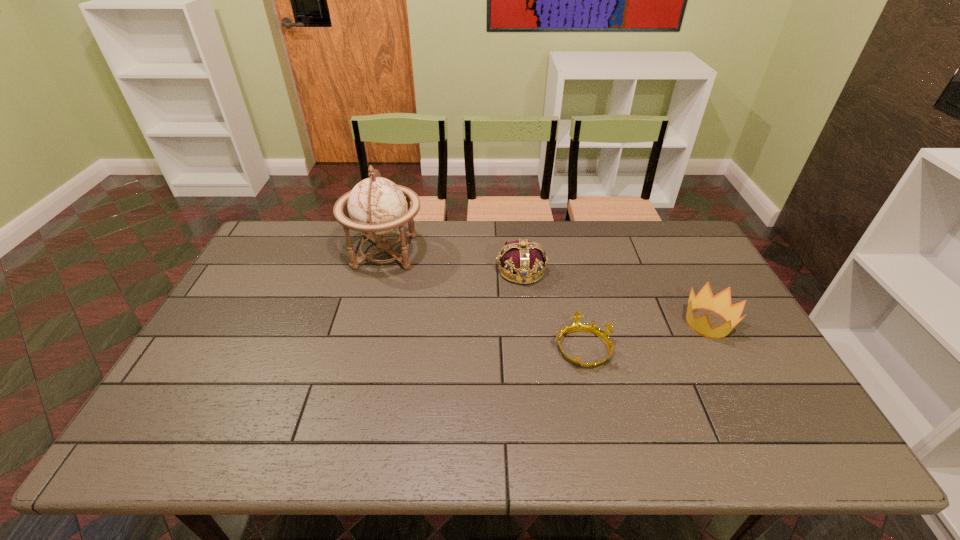
The height and width of the screenshot is (540, 960). Identify the location of vacant region between the farthest crown and the rightmost crown. click(x=614, y=297).

The width and height of the screenshot is (960, 540). In order to click on free spot between the tallest crown and the shortest object in this screenshot , I will do `click(552, 309)`.

Identify the location of free space that is in between the shortest object and the second shortest object. This screenshot has height=540, width=960. (645, 335).

This screenshot has width=960, height=540. I want to click on free point between the leftmost object and the rightmost object, so click(x=546, y=288).

Locate an element on the screen. vacant area that lies between the second shortest crown and the shortest object is located at coordinates (645, 335).

The image size is (960, 540). I want to click on free point between the globe and the rightmost object, so click(x=546, y=288).

The height and width of the screenshot is (540, 960). I want to click on free space between the shortest crown and the rightmost crown, so click(x=645, y=335).

At what (x,y) coordinates should I click in order to perform the action: click on free space between the shortest object and the farthest crown. Please return your answer as a coordinate pair (x, y). The height and width of the screenshot is (540, 960). Looking at the image, I should click on (552, 309).

Locate which object is the third closest to the tallest object. Please provide its 2D coordinates. Your answer should be formatted as a tuple, i.e. [(x, y)], where the tuple contains the x and y coordinates of a point satisfying the conditions above.

[(721, 303)]

Find the location of a particular element. object that is the third closest to the shortest object is located at coordinates (377, 206).